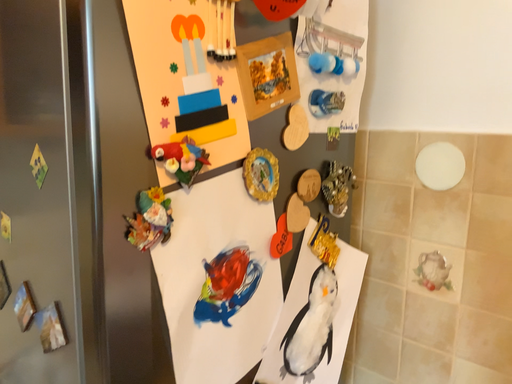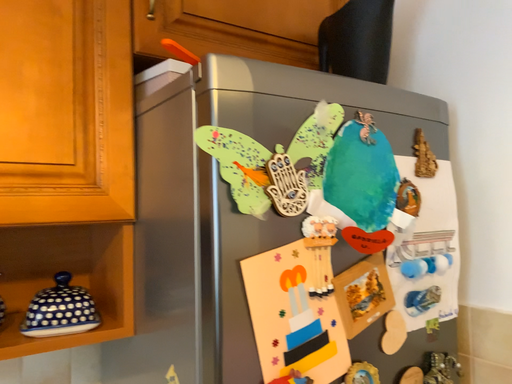
Question: How did the camera likely rotate when shooting the video?

Choices:
 (A) rotated upward
 (B) rotated downward

Answer: (A)